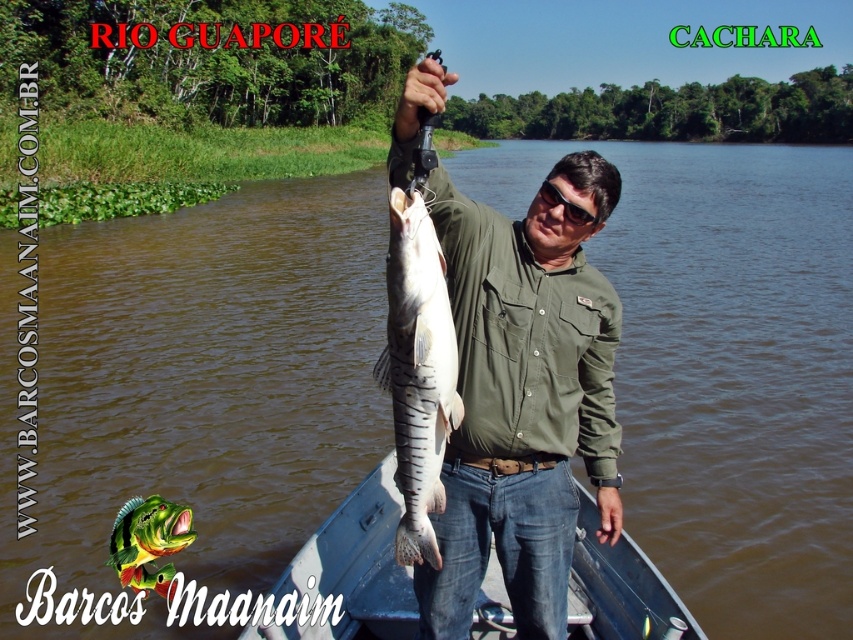
What are the coordinates of the white striped fish at center in the image?

The white striped fish at center is located at coordinates point (418,371).

You are a photographer trying to capture a photo of the green matte shirt at center and the blue plastic boat at center. Which object should you focus on first if you want to include both in your shot without moving the camera?

The green matte shirt at center is not as tall as the blue plastic boat at center, so you should focus on the blue plastic boat at center first to ensure both are in frame.

You are a photographer on the Rio Guapor? wanting to capture a clear photo of the white striped fish at center and the blue plastic boat at center. Since the boat is in the way, can you adjust your position to focus on the fish without the boat blocking it?

The white striped fish at center is behind the blue plastic boat at center, so adjusting your position to focus on the fish might still show the boat blocking it unless you move to a position where the boat is no longer between you and the fish. However, since both are at the center, it might be challenging to avoid the boat blocking the fish in this scenario.